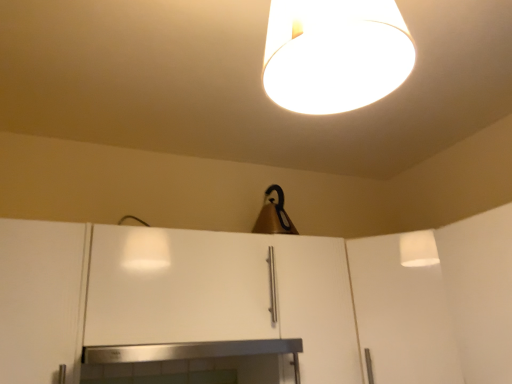
Question: Looking at the image, does stainless steel fireplace at center seem bigger or smaller compared to white matte cabinet at left, which is the 1th cabinetry in left-to-right order?

Choices:
 (A) small
 (B) big

Answer: (A)

Question: From their relative heights in the image, would you say stainless steel fireplace at center is taller or shorter than white matte cabinet at left, which is the 1th cabinetry in left-to-right order?

Choices:
 (A) short
 (B) tall

Answer: (A)

Question: Considering the real-world distances, which object is closest to the stainless steel fireplace at center?

Choices:
 (A) white matte cabinet at left, which is counted as the second cabinetry, starting from the right
 (B) white matte lampshade at upper center, which is the first lamp in front-to-back order
 (C) white matte cabinet at center, placed as the 1th cabinetry when sorted from right to left
 (D) matte brown lampshade at upper center, which appears as the 1th lamp when viewed from the back

Answer: (C)

Question: Which object is positioned farthest from the white matte cabinet at center, which is counted as the 2th cabinetry, starting from the left?

Choices:
 (A) stainless steel fireplace at center
 (B) white matte cabinet at left, which is the 1th cabinetry in left-to-right order
 (C) white matte lampshade at upper center, which is the first lamp in front-to-back order
 (D) matte brown lampshade at upper center, which appears as the 1th lamp when ordered from the bottom

Answer: (C)